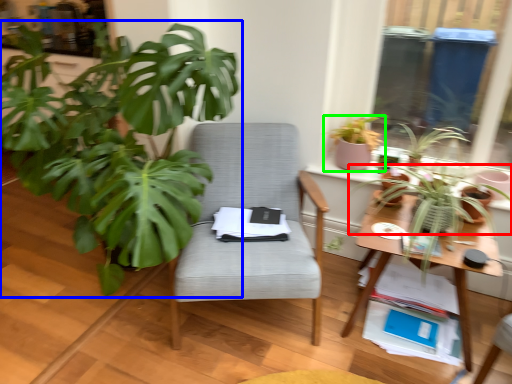
Question: Which object is positioned closest to houseplant (highlighted by a red box)? Select from houseplant (highlighted by a blue box) and houseplant (highlighted by a green box).

Choices:
 (A) houseplant
 (B) houseplant

Answer: (B)